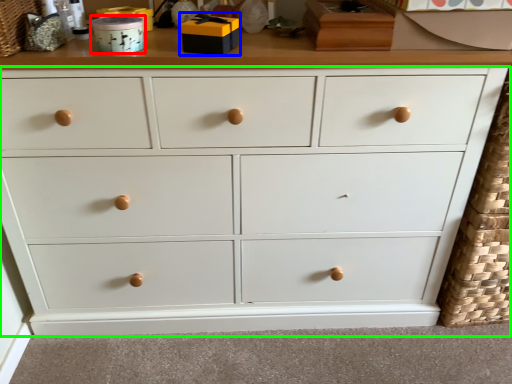
Question: Which object is positioned farthest from toy (highlighted by a red box)? Select from toy (highlighted by a blue box) and chest of drawers (highlighted by a green box).

Choices:
 (A) toy
 (B) chest of drawers

Answer: (B)